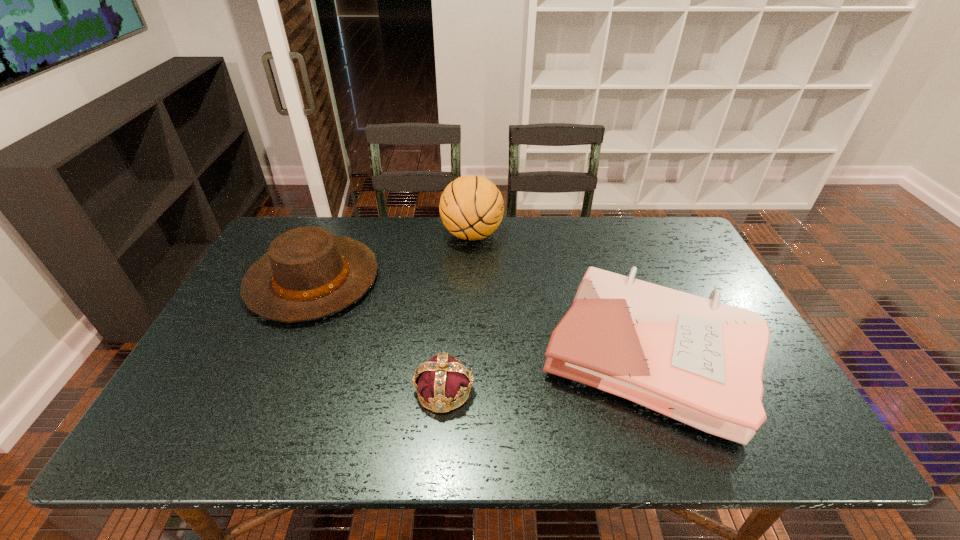
The width and height of the screenshot is (960, 540). What are the coordinates of `cowboy hat positioned at the far edge` in the screenshot? It's located at (308, 273).

In order to click on phonebook at the near edge in this screenshot , I will do `click(699, 361)`.

The width and height of the screenshot is (960, 540). Find the location of `crown present at the near edge`. crown present at the near edge is located at coordinates (441, 380).

Where is `object that is at the left edge`? object that is at the left edge is located at coordinates (308, 273).

The width and height of the screenshot is (960, 540). What are the coordinates of `object that is positioned at the right edge` in the screenshot? It's located at (699, 361).

This screenshot has width=960, height=540. In order to click on object situated at the far left corner in this screenshot , I will do tap(308, 273).

Where is `object that is at the near right corner`? Image resolution: width=960 pixels, height=540 pixels. object that is at the near right corner is located at coordinates (699, 361).

Find the location of a particular element. Image resolution: width=960 pixels, height=540 pixels. vacant space at the far edge of the desktop is located at coordinates (532, 252).

Image resolution: width=960 pixels, height=540 pixels. What are the coordinates of `free region at the near edge` in the screenshot? It's located at (539, 441).

Locate an element on the screen. The image size is (960, 540). vacant space at the left edge of the desktop is located at coordinates (268, 341).